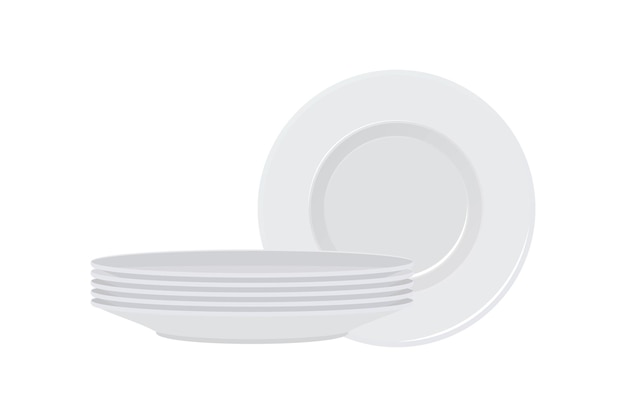
Where is `dinner plate image`? The height and width of the screenshot is (417, 626). dinner plate image is located at coordinates (393, 269), (393, 278), (394, 287), (394, 297), (394, 305), (531, 204).